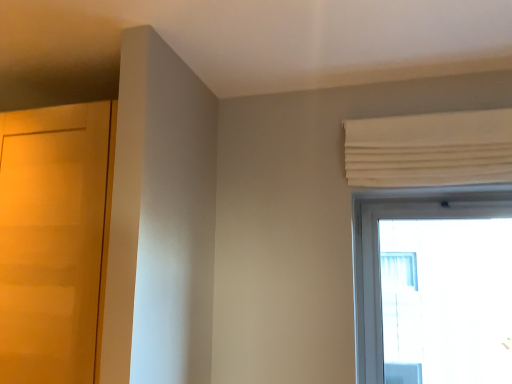
Question: Should I look upward or downward to see white pleated curtain at upper right?

Choices:
 (A) down
 (B) up

Answer: (B)

Question: Considering the relative positions of matte wood door at left and white pleated curtain at upper right in the image provided, is matte wood door at left to the right of white pleated curtain at upper right from the viewer's perspective?

Choices:
 (A) no
 (B) yes

Answer: (A)

Question: Is white pleated curtain at upper right surrounded by matte wood door at left?

Choices:
 (A) yes
 (B) no

Answer: (B)

Question: Does matte wood door at left have a lesser height compared to white pleated curtain at upper right?

Choices:
 (A) no
 (B) yes

Answer: (A)

Question: Is matte wood door at left not within white pleated curtain at upper right?

Choices:
 (A) yes
 (B) no

Answer: (A)

Question: Considering the relative sizes of matte wood door at left and white pleated curtain at upper right in the image provided, is matte wood door at left smaller than white pleated curtain at upper right?

Choices:
 (A) yes
 (B) no

Answer: (B)

Question: From the image's perspective, is matte wood door at left located above white pleated curtain at upper right?

Choices:
 (A) yes
 (B) no

Answer: (B)

Question: Is white pleated curtain at upper right closer to the viewer compared to matte wood door at left?

Choices:
 (A) yes
 (B) no

Answer: (B)

Question: Is white pleated curtain at upper right looking in the opposite direction of matte wood door at left?

Choices:
 (A) no
 (B) yes

Answer: (A)

Question: Can you confirm if white pleated curtain at upper right is positioned to the left of matte wood door at left?

Choices:
 (A) no
 (B) yes

Answer: (A)

Question: Can you confirm if white pleated curtain at upper right is smaller than matte wood door at left?

Choices:
 (A) no
 (B) yes

Answer: (B)

Question: Could matte wood door at left be considered to be inside white pleated curtain at upper right?

Choices:
 (A) no
 (B) yes

Answer: (A)

Question: Is white pleated curtain at upper right shorter than matte wood door at left?

Choices:
 (A) yes
 (B) no

Answer: (A)

Question: From a real-world perspective, is white pleated curtain at upper right positioned above or below matte wood door at left?

Choices:
 (A) below
 (B) above

Answer: (B)